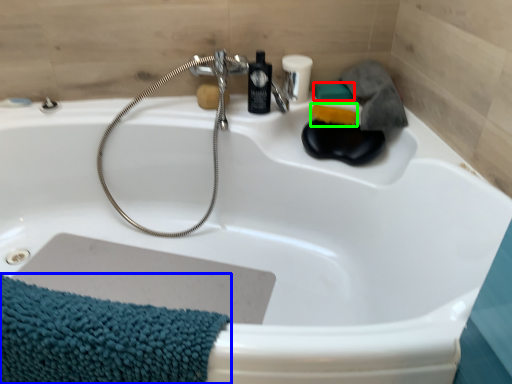
Question: Based on their relative distances, which object is farther from soap (highlighted by a red box)? Choose from bath towel (highlighted by a blue box) and soap (highlighted by a green box).

Choices:
 (A) bath towel
 (B) soap

Answer: (A)